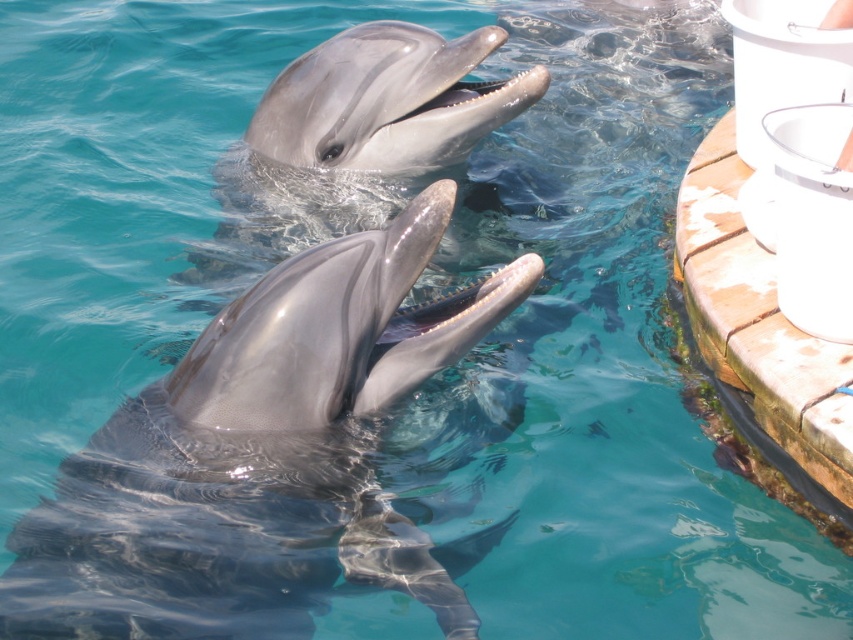
Question: Is the position of glossy gray dolphin at center more distant than that of shiny gray dolphin at upper center?

Choices:
 (A) no
 (B) yes

Answer: (A)

Question: Can you confirm if glossy gray dolphin at center is positioned to the left of shiny gray dolphin at upper center?

Choices:
 (A) yes
 (B) no

Answer: (B)

Question: Which point appears farthest from the camera in this image?

Choices:
 (A) (305, 64)
 (B) (219, 577)

Answer: (A)

Question: Can you confirm if glossy gray dolphin at center is positioned below shiny gray dolphin at upper center?

Choices:
 (A) yes
 (B) no

Answer: (A)

Question: Which point is closer to the camera?

Choices:
 (A) (287, 104)
 (B) (61, 556)

Answer: (B)

Question: Which point appears farthest from the camera in this image?

Choices:
 (A) (254, 145)
 (B) (299, 291)

Answer: (A)